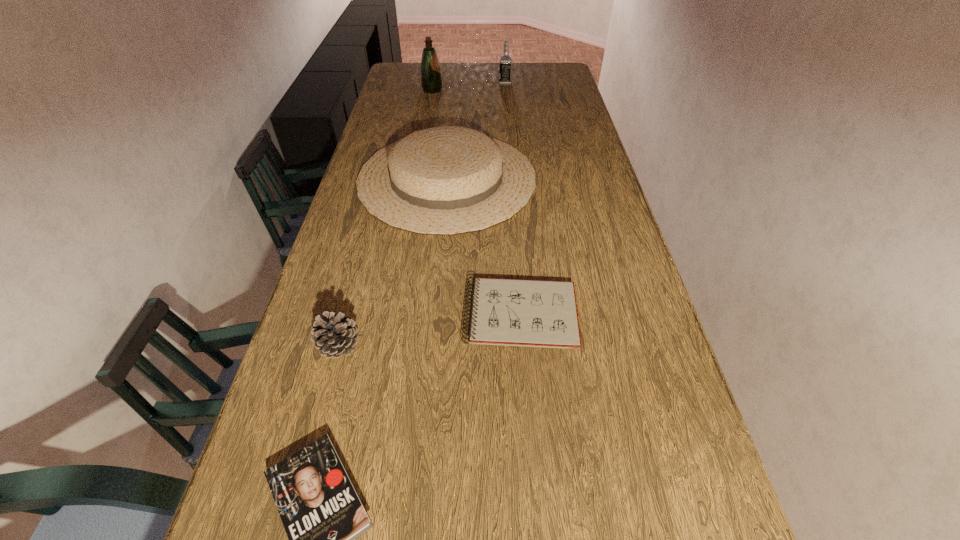
In the image, there is a desktop. Identify the location of vacant space at the right edge. The width and height of the screenshot is (960, 540). (568, 161).

Locate an element on the screen. vacant space at the far left corner of the desktop is located at coordinates (409, 75).

At what (x,y) coordinates should I click in order to perform the action: click on vacant area that lies between the olive oil and the fifth shortest object. Please return your answer as a coordinate pair (x, y). The height and width of the screenshot is (540, 960). Looking at the image, I should click on (468, 86).

Identify the location of free space between the pinecone and the third farthest object. The width and height of the screenshot is (960, 540). (393, 262).

Image resolution: width=960 pixels, height=540 pixels. Find the location of `vacant space in between the third farthest object and the pinecone`. vacant space in between the third farthest object and the pinecone is located at coordinates (393, 262).

Find the location of a particular element. object that is the fourth closest to the fourth nearest object is located at coordinates (505, 66).

The image size is (960, 540). In order to click on object that stands as the fifth closest to the sunhat in this screenshot , I will do `click(322, 514)`.

The image size is (960, 540). I want to click on free space that satisfies the following two spatial constraints: 1. on the front-facing side of the olive oil; 2. on the left side of the third farthest object, so [417, 179].

Image resolution: width=960 pixels, height=540 pixels. Find the location of `vacant area in the image that satisfies the following two spatial constraints: 1. on the front-facing side of the olive oil; 2. on the back side of the notepad`. vacant area in the image that satisfies the following two spatial constraints: 1. on the front-facing side of the olive oil; 2. on the back side of the notepad is located at coordinates (393, 315).

Image resolution: width=960 pixels, height=540 pixels. Find the location of `vacant region that satisfies the following two spatial constraints: 1. on the front-facing side of the sunhat; 2. on the right side of the olive oil`. vacant region that satisfies the following two spatial constraints: 1. on the front-facing side of the sunhat; 2. on the right side of the olive oil is located at coordinates [x=417, y=179].